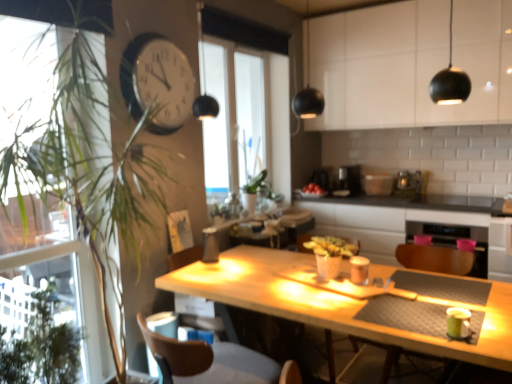
Question: From the image's perspective, is transparent glass window at center above or below green leafy plant at left?

Choices:
 (A) below
 (B) above

Answer: (B)

Question: Would you say transparent glass window at center is inside or outside green leafy plant at left?

Choices:
 (A) inside
 (B) outside

Answer: (B)

Question: Which of these objects is positioned closest to the white glossy cabinet at upper center?

Choices:
 (A) black matte counter at center
 (B) brown leather swivel chair at lower left
 (C) wooden armchair at right
 (D) red matte tomatoes at center
 (E) green leafy plant at left

Answer: (A)

Question: Estimate the real-world distances between objects in this image. Which object is farther from the black plastic coffee maker at center, acting as the 2th appliance starting from the right?

Choices:
 (A) white glossy cabinet at upper center
 (B) red matte tomatoes at center
 (C) brown leather swivel chair at lower left
 (D) transparent glass window at center
 (E) satin silver toaster at center, marked as the second appliance in a left-to-right arrangement

Answer: (C)